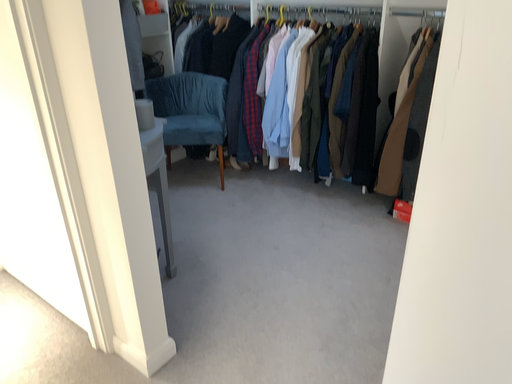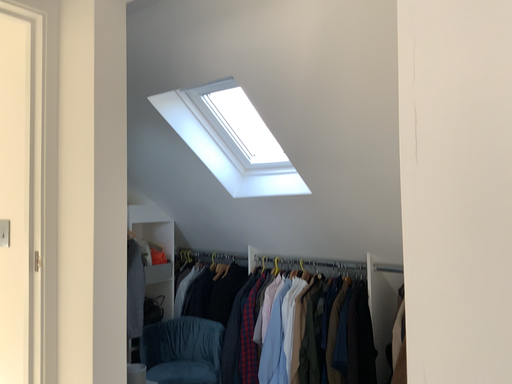
Question: How did the camera likely rotate when shooting the video?

Choices:
 (A) rotated downward
 (B) rotated upward

Answer: (B)